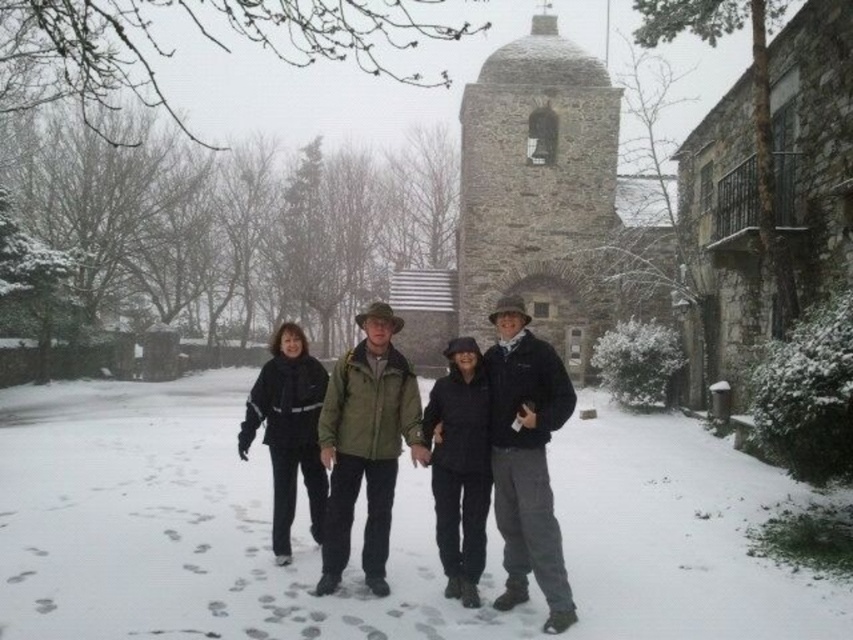
You are a photographer trying to capture the group of people in the snowy scene. You notice the white powdery snow at center and the black matte jacket at center. Which object is lower in height?

The white powdery snow at center is shorter than the black matte jacket at center, so the white powdery snow at center is lower in height.

You are one of the four people in the snowy scene. You are wearing the black woolen coat at center and want to see the bell tower in the background. Since the green matte jacket at center is blocking your view, can you step to your right to get a better look? Please explain why or why not based on their positions.

The black woolen coat at center is behind the green matte jacket at center. If you step to your right, you might still be blocked by the green matte jacket at center unless there is enough space to move around it. However, without knowing the exact arrangement of the group, it is uncertain if stepping right would provide an unobstructed view of the bell tower.